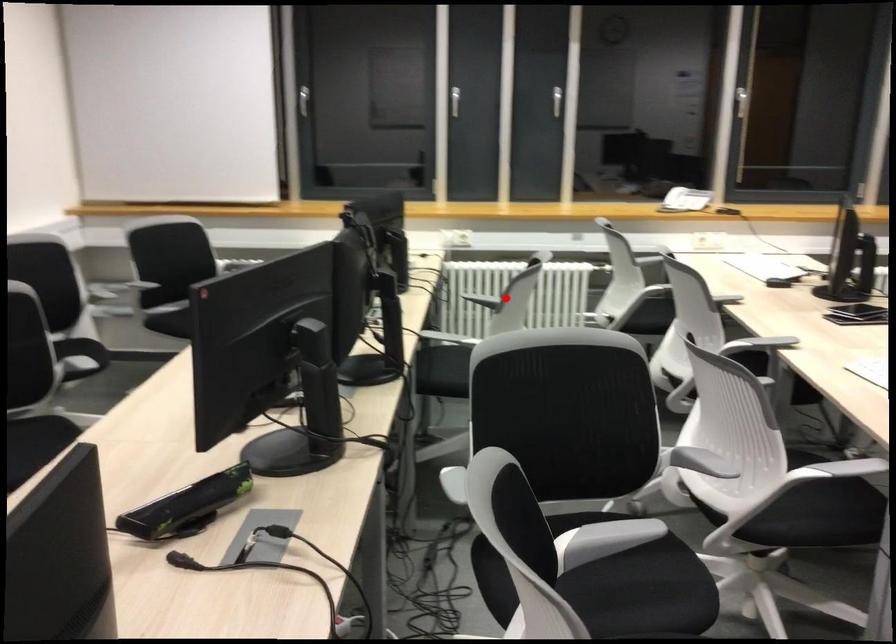
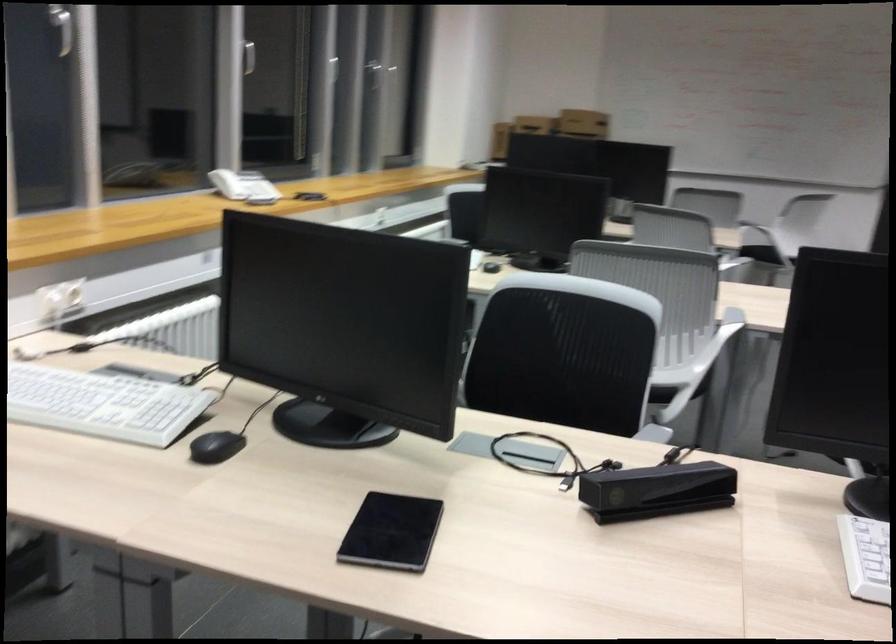
Where in the second image is the point corresponding to the highlighted location from the first image?

(564, 353)